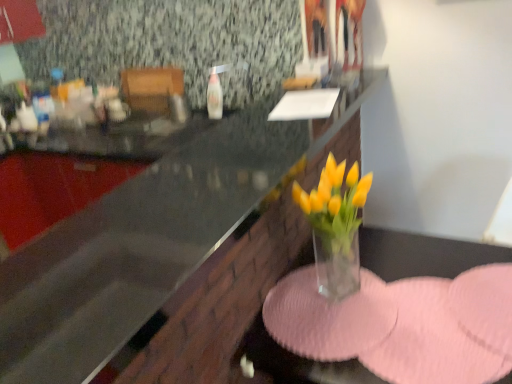
Where is `blank space above transparent glass countertop at center (from a real-world perspective)`? blank space above transparent glass countertop at center (from a real-world perspective) is located at coordinates (237, 163).